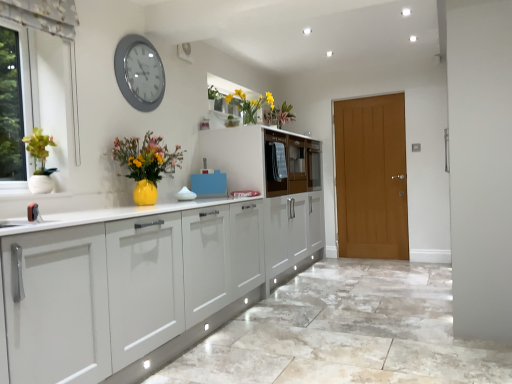
What do you see at coordinates (139, 73) in the screenshot? Image resolution: width=512 pixels, height=384 pixels. I see `silver metallic clock at upper left` at bounding box center [139, 73].

What do you see at coordinates (264, 159) in the screenshot? I see `wooden cabinet at center` at bounding box center [264, 159].

Locate an element on the screen. This screenshot has width=512, height=384. blue plastic cutting board at center is located at coordinates (209, 183).

Looking at this image, measure the distance between point (138,159) and camera.

They are 2.74 meters apart.

What do you see at coordinates (291, 164) in the screenshot?
I see `matte white drawer at center` at bounding box center [291, 164].

Locate an element on the screen. The width and height of the screenshot is (512, 384). matte white drawer at center is located at coordinates (291, 164).

Where is `silver metallic clock at upper left`? This screenshot has width=512, height=384. silver metallic clock at upper left is located at coordinates (139, 73).

Does matte wood door at right have a lesser height compared to blue plastic cutting board at center?

No.

Does point (362, 170) come closer to viewer compared to point (203, 170)?

No, (362, 170) is further to viewer.

Considering the positions of objects yellow matte vase at upper center and silver metallic clock at upper left in the image provided, who is more to the left, yellow matte vase at upper center or silver metallic clock at upper left?

From the viewer's perspective, silver metallic clock at upper left appears more on the left side.

Does yellow matte vase at upper center have a smaller size compared to silver metallic clock at upper left?

No.

From the image's perspective, between yellow matte vase at upper center and silver metallic clock at upper left, which one is located above?

silver metallic clock at upper left, from the image's perspective.

Is blue plastic cutting board at center bigger or smaller than matte white drawer at center?

Considering their sizes, blue plastic cutting board at center takes up less space than matte white drawer at center.

Considering the sizes of objects blue plastic cutting board at center and matte white drawer at center in the image provided, who is thinner, blue plastic cutting board at center or matte white drawer at center?

With smaller width is blue plastic cutting board at center.

Could you tell me if blue plastic cutting board at center is facing matte white drawer at center?

No, blue plastic cutting board at center is not turned towards matte white drawer at center.

Which object is closer to the camera taking this photo, blue plastic cutting board at center or matte white drawer at center?

Positioned in front is blue plastic cutting board at center.

From the image's perspective, which is above, matte yellow vase at center or wooden cabinet at center?

From the image's view, wooden cabinet at center is above.

Considering the positions of objects matte yellow vase at center and wooden cabinet at center in the image provided, who is more to the left, matte yellow vase at center or wooden cabinet at center?

matte yellow vase at center is more to the left.

Is matte yellow vase at center inside the boundaries of wooden cabinet at center, or outside?

matte yellow vase at center exists outside the volume of wooden cabinet at center.

Is point (148, 159) in front of point (283, 145)?

That is True.

Can we say yellow matte vase at upper center lies outside wooden cabinet at center?

That's correct, yellow matte vase at upper center is outside of wooden cabinet at center.

Consider the image. Considering the relative sizes of yellow matte vase at upper center and wooden cabinet at center in the image provided, is yellow matte vase at upper center bigger than wooden cabinet at center?

Actually, yellow matte vase at upper center might be smaller than wooden cabinet at center.

Is silver metallic clock at upper left not near yellow matte vase at upper center?

They are positioned close to each other.

From a real-world perspective, relative to yellow matte vase at upper center, is silver metallic clock at upper left vertically above or below?

From a real-world perspective, silver metallic clock at upper left is physically above yellow matte vase at upper center.

Considering the sizes of objects silver metallic clock at upper left and yellow matte vase at upper center in the image provided, who is bigger, silver metallic clock at upper left or yellow matte vase at upper center?

Bigger between the two is yellow matte vase at upper center.

From the image's perspective, which one is positioned lower, matte white drawer at center or wooden cabinet at center?

From the image's view, wooden cabinet at center is below.

Which object is further away from the camera, matte white drawer at center or wooden cabinet at center?

matte white drawer at center is more distant.

From a real-world perspective, which is physically above, matte white drawer at center or wooden cabinet at center?

In real-world perspective, wooden cabinet at center is above.

Is matte white drawer at center facing towards wooden cabinet at center?

Yes, matte white drawer at center is turned towards wooden cabinet at center.

This screenshot has width=512, height=384. What are the coordinates of `door below the blue plastic cutting board at center (from a real-world perspective)` in the screenshot? It's located at (371, 177).

Locate an element on the screen. This screenshot has width=512, height=384. floral arrangement below the silver metallic clock at upper left (from the image's perspective) is located at coordinates (250, 104).

Which object lies nearer to the anchor point matte white drawer at center, matte wood door at right or silver metallic clock at upper left?

matte wood door at right lies closer to matte white drawer at center than the other object.

In the scene shown: Based on their spatial positions, is matte yellow vase at center or matte wood door at right closer to silver metallic clock at upper left?

matte yellow vase at center lies closer to silver metallic clock at upper left than the other object.

Based on their spatial positions, is matte wood door at right or wooden cabinet at center further from yellow matte vase at upper center?

Among the two, matte wood door at right is located further to yellow matte vase at upper center.

When comparing their distances from blue plastic cutting board at center, does matte yellow vase at center or matte wood door at right seem further?

matte wood door at right is positioned further to the anchor blue plastic cutting board at center.

Looking at this image, from the image, which object appears to be farther from yellow matte vase at upper center, wooden cabinet at center or matte wood door at right?

The object further to yellow matte vase at upper center is matte wood door at right.

Which object lies nearer to the anchor point matte yellow vase at center, yellow matte vase at upper center or wooden cabinet at center?

Based on the image, yellow matte vase at upper center appears to be nearer to matte yellow vase at center.

Which object lies nearer to the anchor point matte wood door at right, wooden cabinet at center or matte yellow vase at center?

Based on the image, wooden cabinet at center appears to be nearer to matte wood door at right.

Looking at the image, which one is located further to matte yellow vase at center, silver metallic clock at upper left or blue plastic cutting board at center?

Based on the image, blue plastic cutting board at center appears to be further to matte yellow vase at center.

I want to click on appliance positioned between silver metallic clock at upper left and matte white drawer at center from near to far, so click(209, 183).

Where is `drawer positioned between wooden cabinet at center and matte wood door at right from near to far`? The image size is (512, 384). drawer positioned between wooden cabinet at center and matte wood door at right from near to far is located at coordinates (291, 164).

At what (x,y) coordinates should I click in order to perform the action: click on clock between matte yellow vase at center and matte wood door at right along the z-axis. Please return your answer as a coordinate pair (x, y). Looking at the image, I should click on (139, 73).

At what (x,y) coordinates should I click in order to perform the action: click on clock between matte yellow vase at center and yellow matte vase at upper center along the z-axis. Please return your answer as a coordinate pair (x, y). The image size is (512, 384). Looking at the image, I should click on point(139,73).